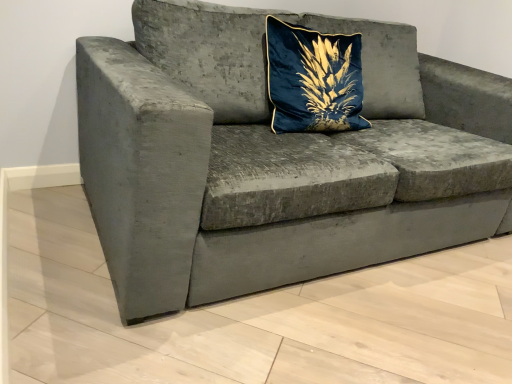
In order to face velvet gray couch at center, should I rotate leftwards or rightwards?

You should look right and rotate roughly 9.232 degrees.

Describe the element at coordinates (275, 158) in the screenshot. I see `velvet gray couch at center` at that location.

Measure the distance between velvet gray couch at center and camera.

velvet gray couch at center and camera are 36.59 inches apart from each other.

You are a GUI agent. You are given a task and a screenshot of the screen. Output one action in this format:
    pyautogui.click(x=<x>, y=<y>)
    Task: Click on the velvet gray couch at center
    This screenshot has height=384, width=512.
    Given the screenshot: What is the action you would take?
    pyautogui.click(x=275, y=158)

This screenshot has height=384, width=512. I want to click on velvet gray couch at center, so click(x=275, y=158).